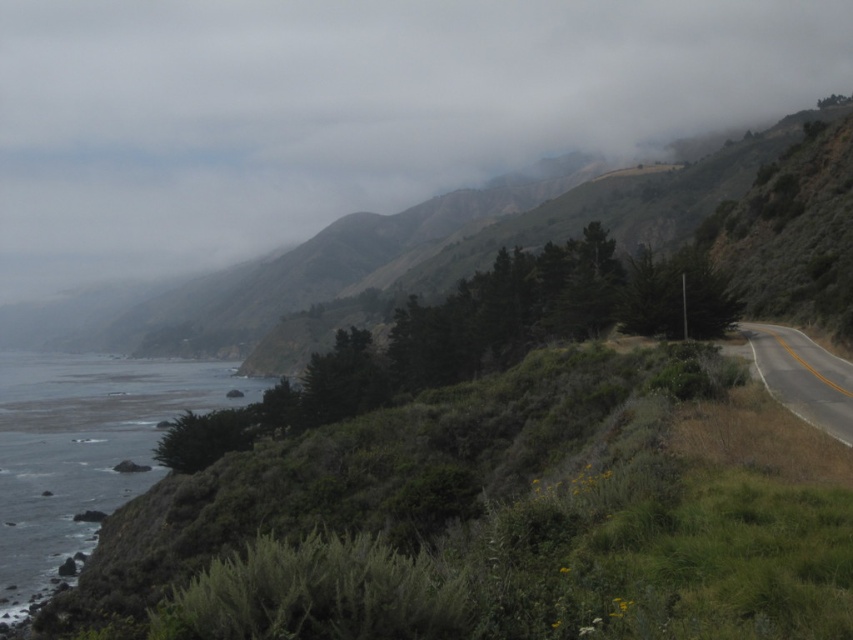
The width and height of the screenshot is (853, 640). Describe the element at coordinates (84, 451) in the screenshot. I see `greenish-blue water at lower left` at that location.

Where is `greenish-blue water at lower left`? greenish-blue water at lower left is located at coordinates (84, 451).

Who is positioned more to the right, foggy misty hillside at upper center or asphalt road at right?

From the viewer's perspective, asphalt road at right appears more on the right side.

Between point (809, 17) and point (764, 372), which one is positioned behind?

Positioned behind is point (809, 17).

The image size is (853, 640). I want to click on foggy misty hillside at upper center, so [x=347, y=109].

Is point (135, 120) farther from camera compared to point (144, 408)?

Yes, point (135, 120) is behind point (144, 408).

Between foggy misty hillside at upper center and greenish-blue water at lower left, which one is positioned higher?

Positioned higher is foggy misty hillside at upper center.

This screenshot has width=853, height=640. I want to click on foggy misty hillside at upper center, so click(x=347, y=109).

Find the location of a particular element. Image resolution: width=853 pixels, height=640 pixels. foggy misty hillside at upper center is located at coordinates (347, 109).